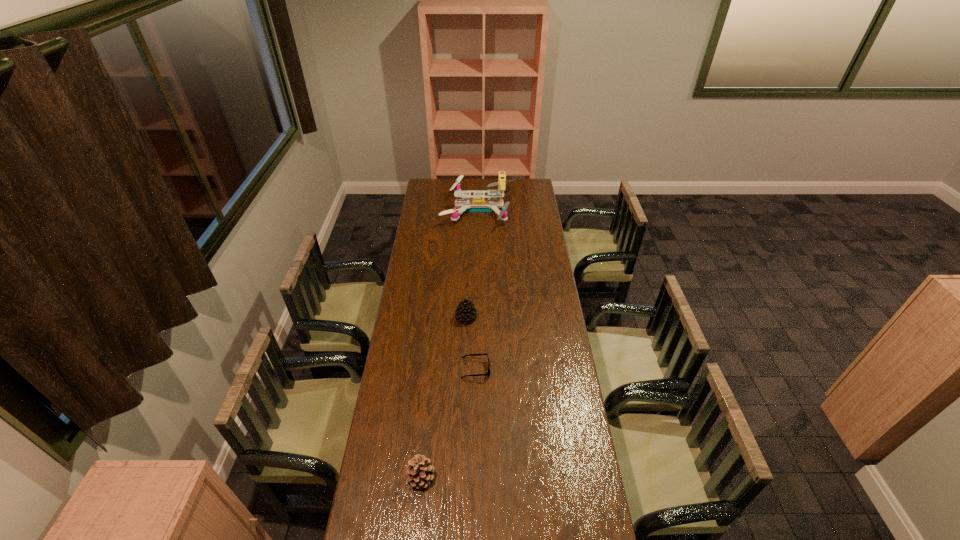
Find the location of a particular element. The height and width of the screenshot is (540, 960). free location located on the right of the left pinecone is located at coordinates (528, 477).

This screenshot has height=540, width=960. In order to click on vacant space located on the front-facing side of the second nearest object in this screenshot , I will do `click(554, 369)`.

Identify the location of object that is at the far edge. This screenshot has width=960, height=540. (478, 204).

Identify the location of drone that is positioned at the left edge. (478, 204).

Identify the location of pinecone that is at the left edge. The height and width of the screenshot is (540, 960). (419, 473).

You are a GUI agent. You are given a task and a screenshot of the screen. Output one action in this format:
    pyautogui.click(x=<x>, y=<y>)
    Task: Click on the object present at the right edge
    The height and width of the screenshot is (540, 960).
    Given the screenshot: What is the action you would take?
    pyautogui.click(x=478, y=204)

You are a GUI agent. You are given a task and a screenshot of the screen. Output one action in this format:
    pyautogui.click(x=<x>, y=<y>)
    Task: Click on the object located at the far left corner
    The height and width of the screenshot is (540, 960).
    Given the screenshot: What is the action you would take?
    pyautogui.click(x=478, y=204)

Find the location of `object at the far right corner`. object at the far right corner is located at coordinates (478, 204).

Locate an element on the screen. The height and width of the screenshot is (540, 960). vacant space at the far edge of the desktop is located at coordinates (486, 191).

Find the location of `vacant space at the left edge`. vacant space at the left edge is located at coordinates (410, 258).